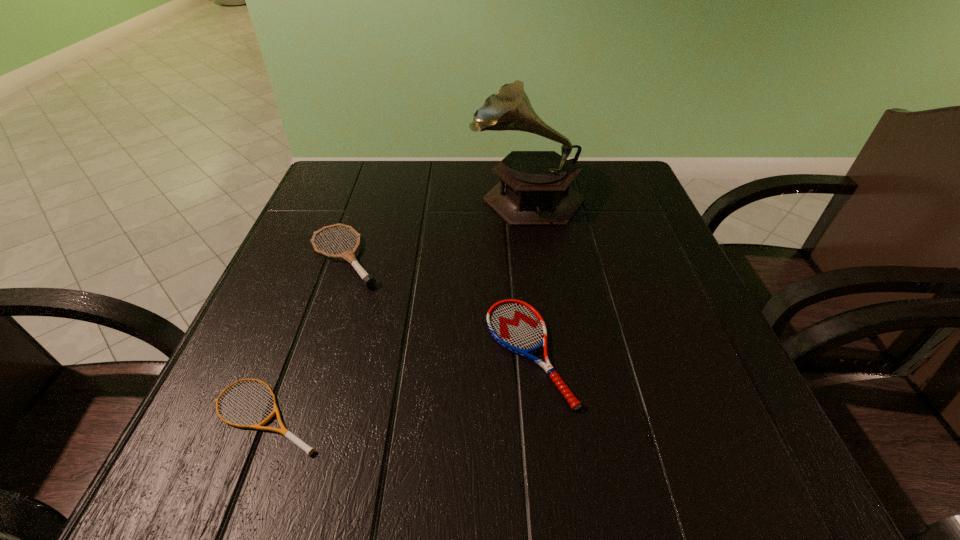
The image size is (960, 540). I want to click on phonograph record, so click(534, 189).

You are a GUI agent. You are given a task and a screenshot of the screen. Output one action in this format:
    pyautogui.click(x=<x>, y=<y>)
    Task: Click on the tallest object
    
    Given the screenshot: What is the action you would take?
    point(534,189)

This screenshot has width=960, height=540. Identify the location of the second farthest object. (368, 280).

Find the location of a particular element. the farthest tennis racket is located at coordinates pyautogui.click(x=368, y=280).

Locate an element on the screen. This screenshot has height=540, width=960. the second shortest object is located at coordinates (517, 326).

You are a GUI agent. You are given a task and a screenshot of the screen. Output one action in this format:
    pyautogui.click(x=<x>, y=<y>)
    Task: Click on the rightmost tennis racket
    The width and height of the screenshot is (960, 540).
    Given the screenshot: What is the action you would take?
    pyautogui.click(x=517, y=326)

Identify the location of the shortest object. The image size is (960, 540). (286, 433).

Where is `vacant space positioned on the horn direction of the phonograph record`? Image resolution: width=960 pixels, height=540 pixels. vacant space positioned on the horn direction of the phonograph record is located at coordinates (395, 195).

This screenshot has width=960, height=540. Identify the location of free spot located 0.120m on the horn direction of the phonograph record. tap(420, 195).

This screenshot has width=960, height=540. I want to click on free space located 0.360m on the horn direction of the phonograph record, so click(320, 195).